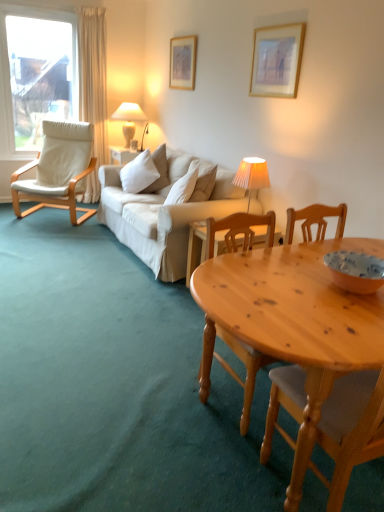
What do you see at coordinates (277, 60) in the screenshot? I see `wooden picture frame at upper center, marked as the 1th picture frame in a right-to-left arrangement` at bounding box center [277, 60].

This screenshot has width=384, height=512. I want to click on wooden picture frame at upper center, the second picture frame in the back-to-front sequence, so click(277, 60).

The width and height of the screenshot is (384, 512). What are the coordinates of `white fabric chair at left` in the screenshot? It's located at (58, 170).

What do you see at coordinates (293, 322) in the screenshot? I see `natural wood table at lower right` at bounding box center [293, 322].

This screenshot has height=512, width=384. Describe the element at coordinates (183, 62) in the screenshot. I see `wooden picture frame at upper center, the second picture frame when ordered from bottom to top` at that location.

At what (x,y) coordinates should I click in order to perform the action: click on white soft cushion at center. Please return your answer as a coordinate pair (x, y). The image size is (384, 512). Looking at the image, I should click on (139, 173).

Is wooden picture frame at upper center, marked as the 1th picture frame in a front-to-back arrangement, oriented away from white fabric chair at left?

No, white fabric chair at left is not at the back of wooden picture frame at upper center, marked as the 1th picture frame in a front-to-back arrangement.

Considering the sizes of objects wooden picture frame at upper center, the second picture frame in the back-to-front sequence, and white fabric chair at left in the image provided, who is taller, wooden picture frame at upper center, the second picture frame in the back-to-front sequence, or white fabric chair at left?

white fabric chair at left is taller.

Is wooden picture frame at upper center, the second picture frame in the back-to-front sequence, to the left or to the right of white fabric chair at left in the image?

wooden picture frame at upper center, the second picture frame in the back-to-front sequence, is to the right of white fabric chair at left.

How much distance is there between wooden picture frame at upper center, which ranks as the 2th picture frame in top-to-bottom order, and white fabric chair at left?

wooden picture frame at upper center, which ranks as the 2th picture frame in top-to-bottom order, and white fabric chair at left are 2.26 meters apart.

Is point (261, 160) closer or farther from the camera than point (253, 61)?

Point (261, 160) appears to be closer to the viewer than point (253, 61).

Based on the photo, considering the relative positions of white pleated fabric lampshade at center, the second lamp positioned from the back, and wooden picture frame at upper center, marked as the 1th picture frame in a front-to-back arrangement, in the image provided, is white pleated fabric lampshade at center, the second lamp positioned from the back, to the left of wooden picture frame at upper center, marked as the 1th picture frame in a front-to-back arrangement, from the viewer's perspective?

Indeed, white pleated fabric lampshade at center, the second lamp positioned from the back, is positioned on the left side of wooden picture frame at upper center, marked as the 1th picture frame in a front-to-back arrangement.

How different are the orientations of white pleated fabric lampshade at center, which is the 2th lamp from left to right, and wooden picture frame at upper center, the second picture frame in the left-to-right sequence, in degrees?

There is a 1.37-degree angle between the facing directions of white pleated fabric lampshade at center, which is the 2th lamp from left to right, and wooden picture frame at upper center, the second picture frame in the left-to-right sequence.

Where is `the 2nd picture frame above the white pleated fabric lampshade at center, the second lamp positioned from the back (from a real-world perspective)`? The width and height of the screenshot is (384, 512). the 2nd picture frame above the white pleated fabric lampshade at center, the second lamp positioned from the back (from a real-world perspective) is located at coordinates (277, 60).

Find the location of a particular element. The height and width of the screenshot is (512, 384). lamp on the left of wooden picture frame at upper center, the second picture frame when ordered from bottom to top is located at coordinates (129, 119).

Is white ceramic lamp at upper center, which is the 2th lamp in front-to-back order, bigger or smaller than wooden picture frame at upper center, the second picture frame when ordered from bottom to top?

Considering their sizes, white ceramic lamp at upper center, which is the 2th lamp in front-to-back order, takes up more space than wooden picture frame at upper center, the second picture frame when ordered from bottom to top.

From the image's perspective, between matte orange bowl at lower right and wooden picture frame at upper center, the second picture frame in the front-to-back sequence, who is located below?

matte orange bowl at lower right is shown below in the image.

Is wooden picture frame at upper center, the second picture frame when ordered from bottom to top, a part of matte orange bowl at lower right?

No, wooden picture frame at upper center, the second picture frame when ordered from bottom to top, is located outside of matte orange bowl at lower right.

From a real-world perspective, is matte orange bowl at lower right positioned over wooden picture frame at upper center, positioned as the second picture frame in right-to-left order, based on gravity?

Incorrect, from a real-world perspective, matte orange bowl at lower right is lower than wooden picture frame at upper center, positioned as the second picture frame in right-to-left order.

Which of these two, matte orange bowl at lower right or wooden picture frame at upper center, the second picture frame when ordered from bottom to top, is thinner?

With smaller width is wooden picture frame at upper center, the second picture frame when ordered from bottom to top.

Considering the relative positions of white pleated fabric lampshade at center, placed as the first lamp when sorted from bottom to top, and white soft cushion at center in the image provided, is white pleated fabric lampshade at center, placed as the first lamp when sorted from bottom to top, to the left or to the right of white soft cushion at center?

Clearly, white pleated fabric lampshade at center, placed as the first lamp when sorted from bottom to top, is on the right of white soft cushion at center in the image.

Is the depth of white pleated fabric lampshade at center, which is the 2th lamp from left to right, less than that of white soft cushion at center?

Yes, it is.

Is white pleated fabric lampshade at center, the second lamp positioned from the back, wider or thinner than white soft cushion at center?

white pleated fabric lampshade at center, the second lamp positioned from the back, is thinner than white soft cushion at center.

From the image's perspective, is natural wood table at lower right on wooden picture frame at upper center, marked as the 1th picture frame in a right-to-left arrangement?

No, from the image's perspective, natural wood table at lower right is not on top of wooden picture frame at upper center, marked as the 1th picture frame in a right-to-left arrangement.

In the image, is natural wood table at lower right positioned in front of or behind wooden picture frame at upper center, marked as the 1th picture frame in a right-to-left arrangement?

natural wood table at lower right is positioned closer to the viewer than wooden picture frame at upper center, marked as the 1th picture frame in a right-to-left arrangement.

From a real-world perspective, who is located higher, natural wood table at lower right or wooden picture frame at upper center, marked as the 1th picture frame in a right-to-left arrangement?

wooden picture frame at upper center, marked as the 1th picture frame in a right-to-left arrangement.

Consider the image. Who is shorter, wooden picture frame at upper center, positioned as the second picture frame in right-to-left order, or white soft cushion at center?

white soft cushion at center.

From a real-world perspective, is wooden picture frame at upper center, positioned as the second picture frame in right-to-left order, positioned under white soft cushion at center based on gravity?

No, from a real-world perspective, wooden picture frame at upper center, positioned as the second picture frame in right-to-left order, is not beneath white soft cushion at center.

The image size is (384, 512). Identify the location of picture frame located behind the white soft cushion at center. (183, 62).

Where is `the 1st picture frame above the white fabric chair at left (from the image's perspective)`? the 1st picture frame above the white fabric chair at left (from the image's perspective) is located at coordinates (277, 60).

You are a GUI agent. You are given a task and a screenshot of the screen. Output one action in this format:
    pyautogui.click(x=<x>, y=<y>)
    Task: Click on the picture frame that appears on the right of white pleated fabric lampshade at center, which is the 2th lamp from top to bottom
    The image size is (384, 512).
    Given the screenshot: What is the action you would take?
    pyautogui.click(x=277, y=60)

Considering their positions, is white ceramic lamp at upper center, positioned as the second lamp in bottom-to-top order, positioned closer to wooden picture frame at upper center, placed as the 1th picture frame when sorted from top to bottom, than matte orange bowl at lower right?

white ceramic lamp at upper center, positioned as the second lamp in bottom-to-top order, lies closer to wooden picture frame at upper center, placed as the 1th picture frame when sorted from top to bottom, than the other object.

From the image, which object appears to be farther from white soft cushion at center, white fabric chair at left or matte orange bowl at lower right?

The object further to white soft cushion at center is matte orange bowl at lower right.

From the image, which object appears to be farther from natural wood table at lower right, wooden picture frame at upper center, the 1th picture frame from the bottom, or matte orange bowl at lower right?

The object further to natural wood table at lower right is wooden picture frame at upper center, the 1th picture frame from the bottom.

Looking at the image, which one is located further to natural wood table at lower right, wooden picture frame at upper center, the second picture frame in the left-to-right sequence, or white soft cushion at center?

Based on the image, white soft cushion at center appears to be further to natural wood table at lower right.

Which object lies further to the anchor point white fabric chair at left, white ceramic lamp at upper center, positioned as the 1th lamp in back-to-front order, or white soft cushion at center?

white ceramic lamp at upper center, positioned as the 1th lamp in back-to-front order.

Looking at the image, which one is located closer to matte orange bowl at lower right, white fabric chair at left or white soft cushion at center?

white soft cushion at center is closer to matte orange bowl at lower right.

When comparing their distances from matte orange bowl at lower right, does white soft cushion at center or white fabric chair at left seem further?

Based on the image, white fabric chair at left appears to be further to matte orange bowl at lower right.

Estimate the real-world distances between objects in this image. Which object is closer to white soft cushion at center, white ceramic lamp at upper center, which is the 2th lamp in front-to-back order, or white fabric chair at left?

white fabric chair at left.

Image resolution: width=384 pixels, height=512 pixels. In order to click on picture frame between white pleated fabric lampshade at center, which is the 2th lamp from left to right, and white ceramic lamp at upper center, positioned as the second lamp in bottom-to-top order, along the z-axis in this screenshot , I will do `click(183, 62)`.

Locate an element on the screen. chair between matte orange bowl at lower right and wooden picture frame at upper center, placed as the 1th picture frame when sorted from top to bottom, along the z-axis is located at coordinates (58, 170).

In order to click on picture frame between white fabric chair at left and white pleated fabric lampshade at center, the second lamp positioned from the back, in the horizontal direction in this screenshot , I will do `click(183, 62)`.

I want to click on picture frame positioned between natural wood table at lower right and wooden picture frame at upper center, positioned as the second picture frame in right-to-left order, from near to far, so click(x=277, y=60).